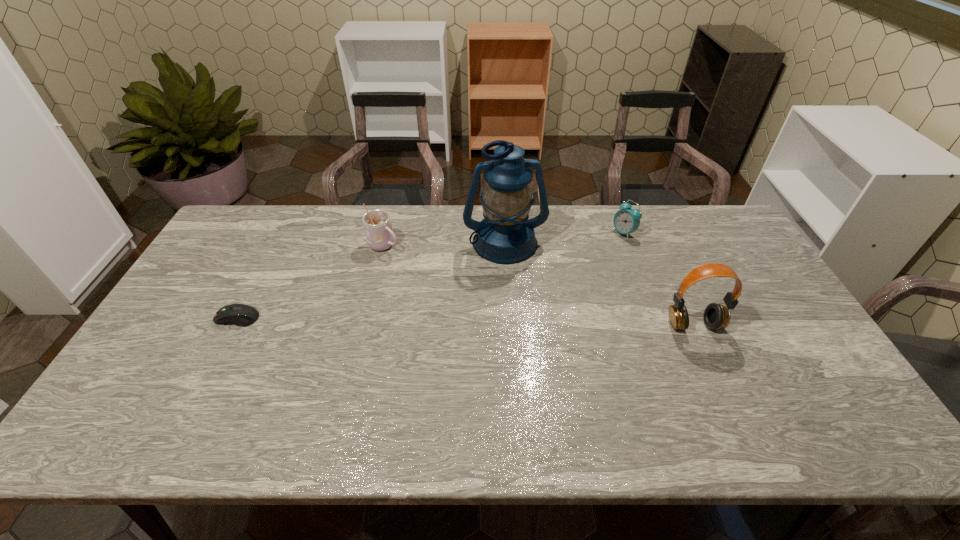
Where is `blank space located 0.080m on the ear cups of the headset`? The height and width of the screenshot is (540, 960). blank space located 0.080m on the ear cups of the headset is located at coordinates (709, 360).

The width and height of the screenshot is (960, 540). What are the coordinates of `free space located on the face of the alarm clock` in the screenshot? It's located at (586, 264).

Identify the location of blank space located 0.390m on the face of the alarm clock. (543, 296).

Find the location of a particular element. vacant region located on the face of the alarm clock is located at coordinates (579, 269).

Locate an element on the screen. The image size is (960, 540). blank area located on the side with the handle of the cup is located at coordinates (449, 282).

The width and height of the screenshot is (960, 540). Find the location of `vacant space located 0.150m on the side with the handle of the cup`. vacant space located 0.150m on the side with the handle of the cup is located at coordinates (430, 271).

Locate an element on the screen. The height and width of the screenshot is (540, 960). vacant area located 0.090m on the side with the handle of the cup is located at coordinates (416, 263).

Locate an element on the screen. vacant area located 0.300m on the face of the third object from right to left is located at coordinates (526, 339).

Identify the location of vacant space located 0.150m on the face of the third object from right to left. This screenshot has width=960, height=540. (517, 299).

I want to click on blank area located 0.110m on the face of the third object from right to left, so click(516, 289).